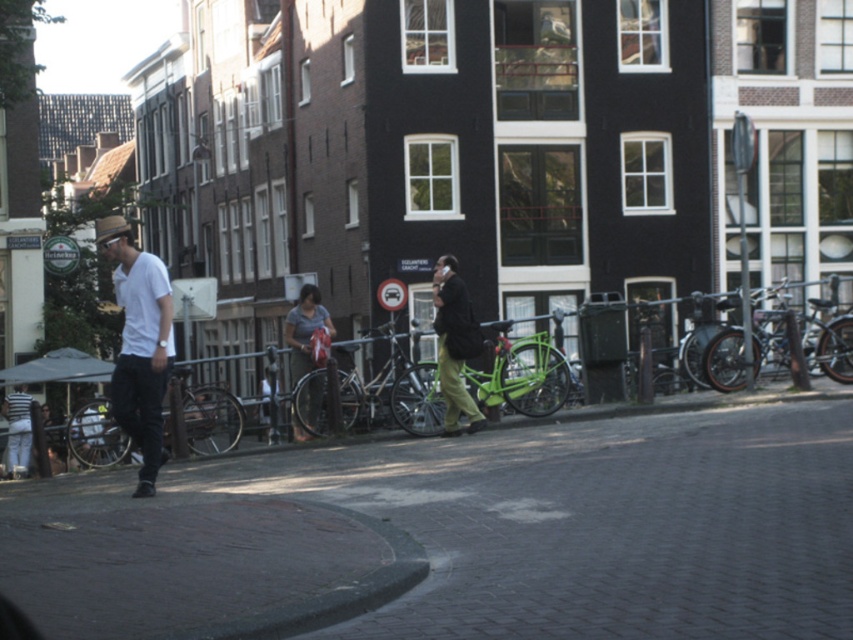
Question: Considering the real-world distances, which object is farthest from the shiny metallic bicycle at right?

Choices:
 (A) matte gray shirt at center
 (B) white matte shirt at left
 (C) dark green pants at center

Answer: (B)

Question: Is white matte shirt at left wider than shiny metallic bicycle at right?

Choices:
 (A) no
 (B) yes

Answer: (A)

Question: In this image, where is green matte bicycle at center located relative to matte black bicycle at left?

Choices:
 (A) below
 (B) above

Answer: (B)

Question: Does matte black bicycle at left appear on the left side of metallic gray fence at lower left?

Choices:
 (A) no
 (B) yes

Answer: (B)

Question: Which object is farther from the camera taking this photo?

Choices:
 (A) white matte shirt at left
 (B) green matte bicycle at center

Answer: (B)

Question: Among these points, which one is nearest to the camera?

Choices:
 (A) (433, 422)
 (B) (134, 324)
 (C) (289, 320)
 (D) (167, 436)

Answer: (B)